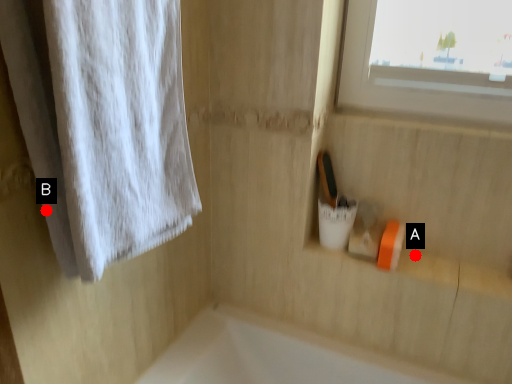
Question: Two points are circled on the image, labeled by A and B beside each circle. Which point appears farthest from the camera in this image?

Choices:
 (A) A is further
 (B) B is further

Answer: (A)